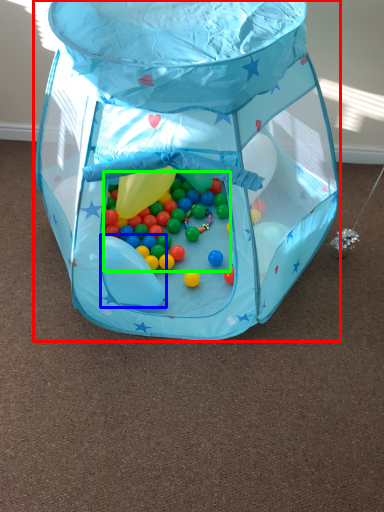
Question: Considering the real-world distances, which object is closest to toy (highlighted by a red box)? balloon (highlighted by a blue box) or candy (highlighted by a green box).

Choices:
 (A) balloon
 (B) candy

Answer: (B)